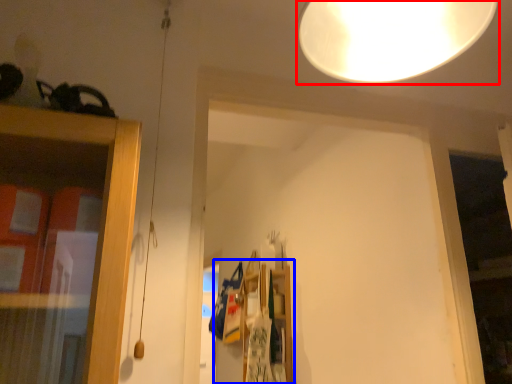
Question: Which object is further to the camera taking this photo, lamp (highlighted by a red box) or shelf (highlighted by a blue box)?

Choices:
 (A) lamp
 (B) shelf

Answer: (B)